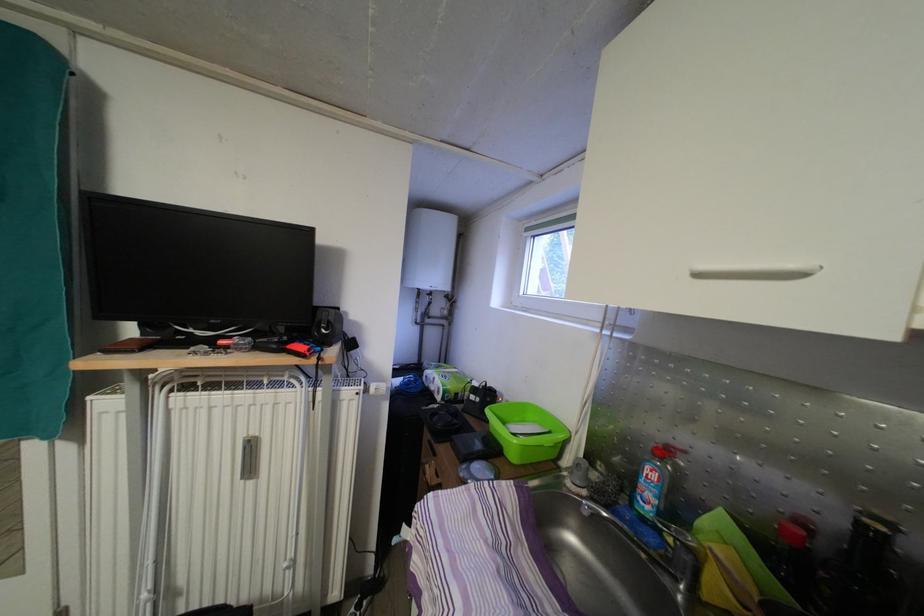
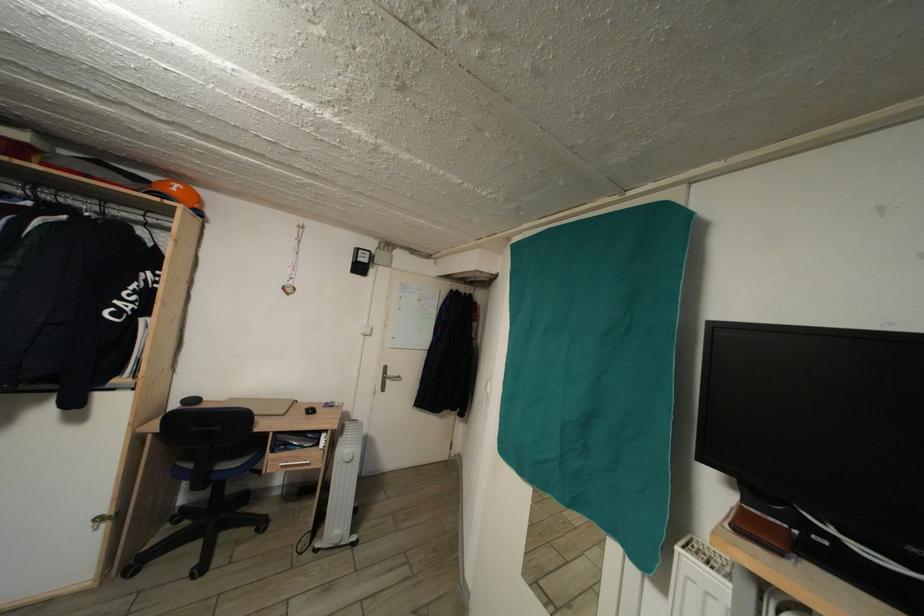
Question: The first image is from the beginning of the video and the second image is from the end. How did the camera likely rotate when shooting the video?

Choices:
 (A) Left
 (B) Right
 (C) Up
 (D) Down

Answer: (A)